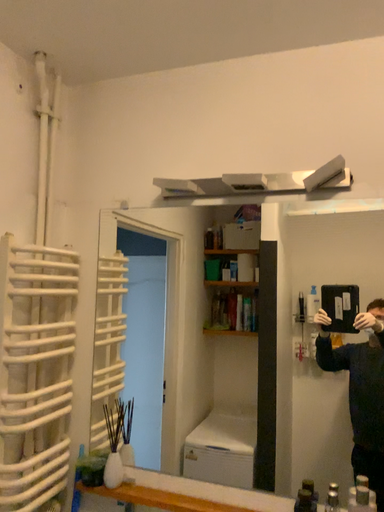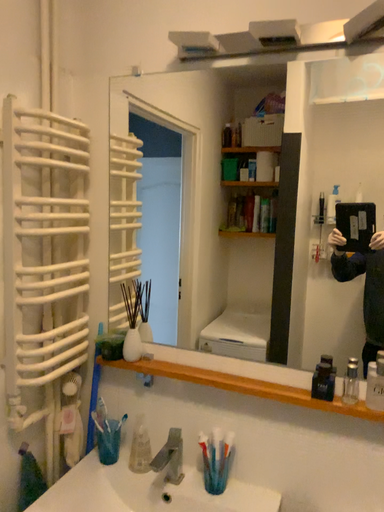
Question: Which way did the camera rotate in the video?

Choices:
 (A) rotated downward
 (B) rotated upward

Answer: (A)